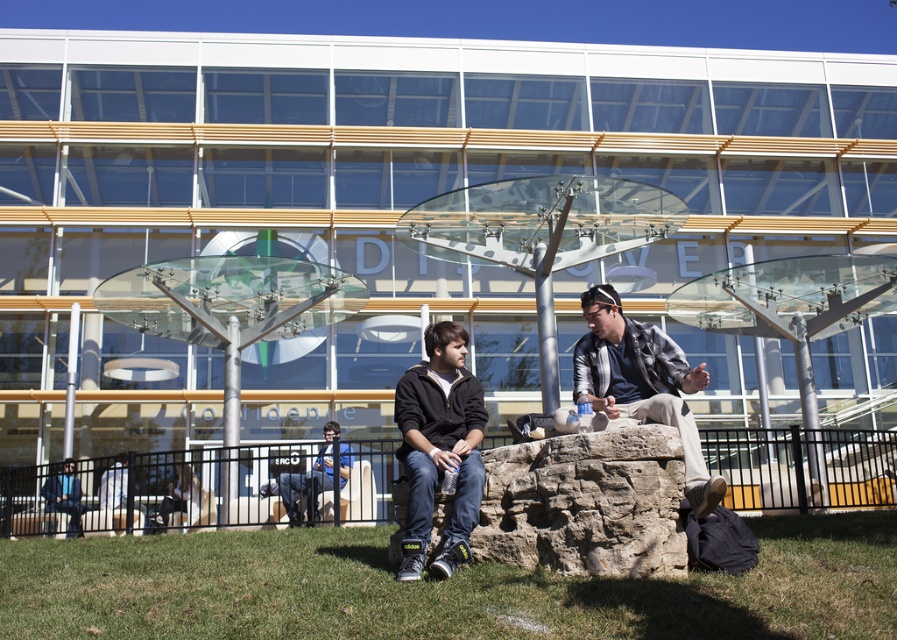
Is plaid fabric jacket at center further to the viewer compared to blue denim jeans at center?

No.

Can you confirm if plaid fabric jacket at center is bigger than blue denim jeans at center?

Actually, plaid fabric jacket at center might be smaller than blue denim jeans at center.

Looking at this image, measure the distance between plaid fabric jacket at center and camera.

plaid fabric jacket at center is 4.80 meters away from camera.

Find the location of a particular element. plaid fabric jacket at center is located at coordinates (640, 384).

Which is behind, point (858, 524) or point (403, 436)?

The point (858, 524) is behind.

Looking at this image, can you confirm if green grass at lower center is smaller than black matte jacket at center?

Yes.

Locate an element on the screen. The width and height of the screenshot is (897, 640). green grass at lower center is located at coordinates (440, 588).

Find the location of a particular element. green grass at lower center is located at coordinates (440, 588).

Can you confirm if brown rough stone at center is taller than blue denim jeans at center?

In fact, brown rough stone at center may be shorter than blue denim jeans at center.

The height and width of the screenshot is (640, 897). I want to click on brown rough stone at center, so click(x=585, y=502).